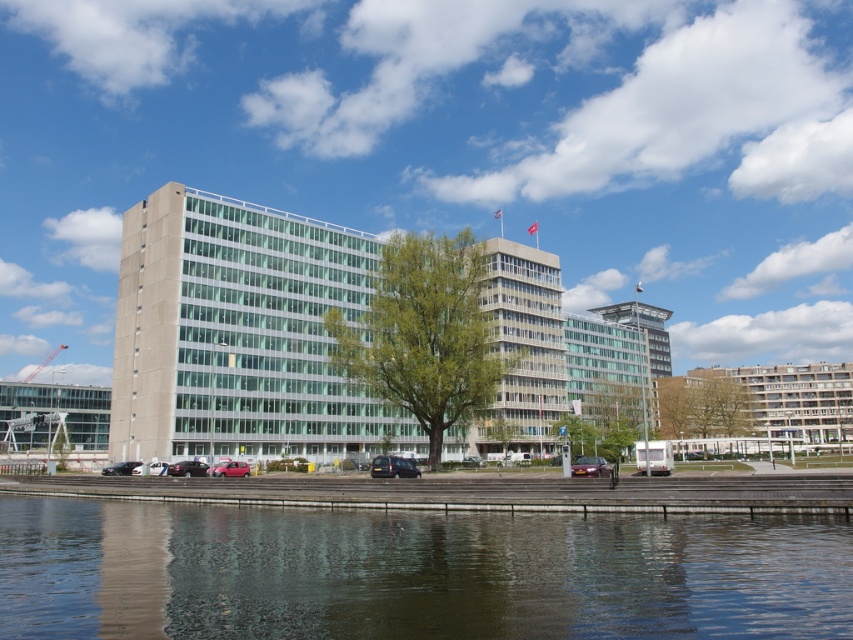
Question: Among these points, which one is nearest to the camera?

Choices:
 (A) (142, 472)
 (B) (108, 474)
 (C) (201, 472)

Answer: (C)

Question: Which of the following is the farthest from the observer?

Choices:
 (A) (242, 474)
 (B) (581, 474)

Answer: (A)

Question: Does matte red car at lower left have a larger size compared to shiny silver car at lower left?

Choices:
 (A) no
 (B) yes

Answer: (B)

Question: Can you confirm if transparent water at lower center is positioned to the left of shiny silver car at lower left?

Choices:
 (A) no
 (B) yes

Answer: (A)

Question: Based on their relative distances, which object is nearer to the matte black car at lower left?

Choices:
 (A) shiny silver car at lower left
 (B) dark gray matte car at center

Answer: (A)

Question: Can you confirm if metallic purple car at center is positioned above shiny silver car at lower left?

Choices:
 (A) yes
 (B) no

Answer: (A)